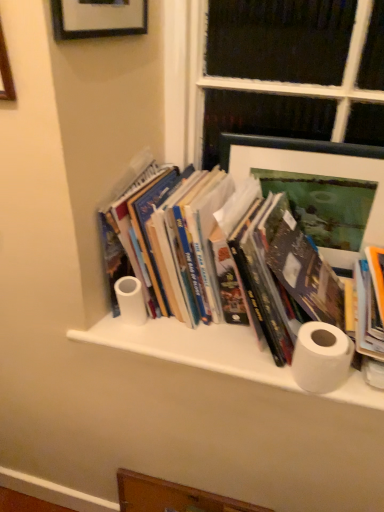
The image size is (384, 512). In order to click on vacant area that is in front of white matte toilet paper at center, the first toilet paper viewed from the left in this screenshot , I will do `click(139, 341)`.